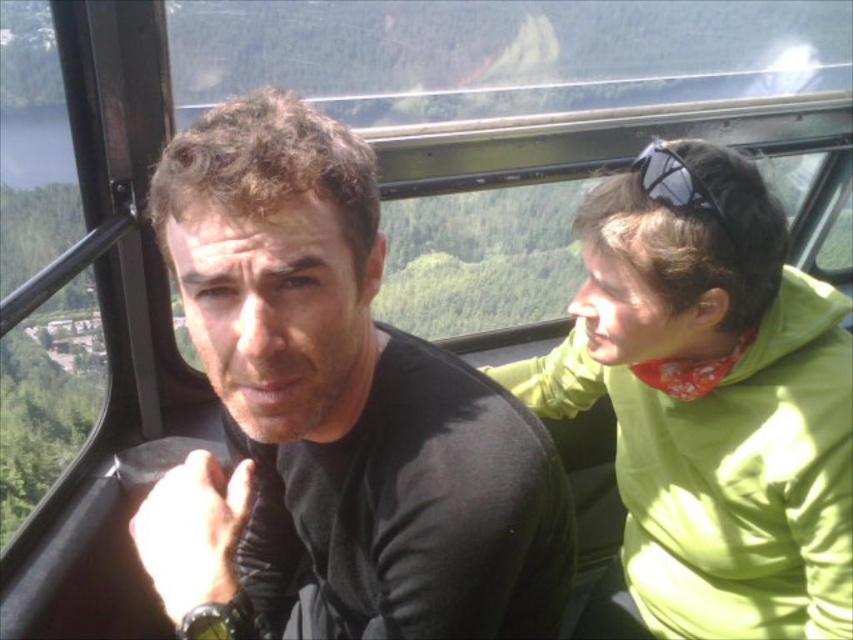
Can you confirm if black matte shirt at center is positioned to the left of black matte sunglasses at upper right?

Indeed, black matte shirt at center is positioned on the left side of black matte sunglasses at upper right.

Which is in front, point (399, 365) or point (651, 144)?

Point (399, 365) is in front.

Where is `black matte shirt at center`? The image size is (853, 640). black matte shirt at center is located at coordinates (334, 413).

Does black matte shirt at center appear on the right side of green fleece jacket at right?

In fact, black matte shirt at center is to the left of green fleece jacket at right.

Does black matte shirt at center have a smaller size compared to green fleece jacket at right?

Indeed, black matte shirt at center has a smaller size compared to green fleece jacket at right.

Image resolution: width=853 pixels, height=640 pixels. In order to click on black matte shirt at center in this screenshot , I will do `click(334, 413)`.

Between point (709, 624) and point (670, 196), which one is positioned in front?

Point (670, 196) is more forward.

Which is more to the right, green fleece jacket at right or black matte sunglasses at upper right?

green fleece jacket at right

The height and width of the screenshot is (640, 853). Identify the location of green fleece jacket at right. (711, 401).